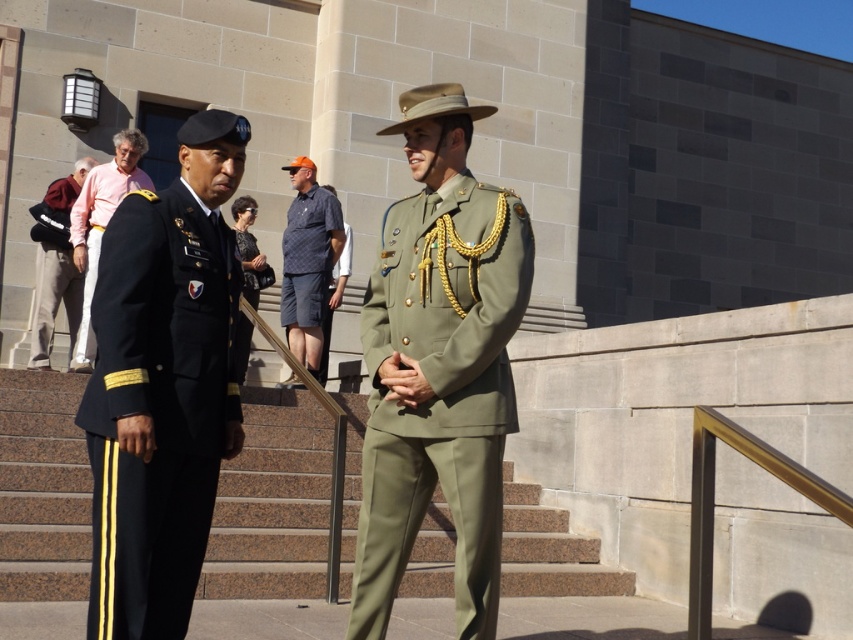
Does olive green fabric uniform at center appear on the right side of dark green fabric uniform at center?

Correct, you'll find olive green fabric uniform at center to the right of dark green fabric uniform at center.

Does olive green fabric uniform at center appear over dark green fabric uniform at center?

Actually, olive green fabric uniform at center is below dark green fabric uniform at center.

This screenshot has width=853, height=640. I want to click on olive green fabric uniform at center, so click(x=440, y=392).

How distant is olive green fabric uniform at center from dark gray pants at lower left?

olive green fabric uniform at center is 6.90 meters away from dark gray pants at lower left.

Is the position of olive green fabric uniform at center more distant than that of dark gray pants at lower left?

No, olive green fabric uniform at center is closer to the viewer.

Measure the distance between olive green fabric uniform at center and camera.

olive green fabric uniform at center and camera are 4.33 meters apart.

Find the location of a particular element. olive green fabric uniform at center is located at coordinates (440, 392).

Looking at this image, does pink fabric shirt at left come behind dark gray pants at lower left?

That is False.

Looking at this image, is pink fabric shirt at left closer to camera compared to dark gray pants at lower left?

Yes, it is in front of dark gray pants at lower left.

What do you see at coordinates (102, 224) in the screenshot? I see `pink fabric shirt at left` at bounding box center [102, 224].

Locate an element on the screen. Image resolution: width=853 pixels, height=640 pixels. pink fabric shirt at left is located at coordinates (102, 224).